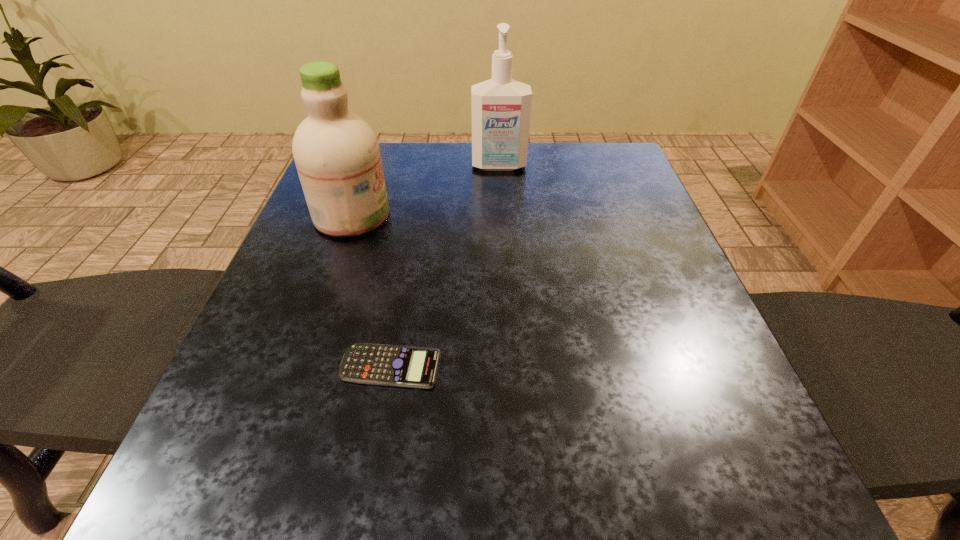
Locate an element on the screen. The image size is (960, 540). free location that satisfies the following two spatial constraints: 1. on the front label of the shortest object; 2. on the left side of the second nearest object is located at coordinates (299, 367).

You are a GUI agent. You are given a task and a screenshot of the screen. Output one action in this format:
    pyautogui.click(x=<x>, y=<y>)
    Task: Click on the free spot that satisfies the following two spatial constraints: 1. on the front label of the nearest object; 2. on the right side of the left cleansing agent
    The height and width of the screenshot is (540, 960).
    Given the screenshot: What is the action you would take?
    pyautogui.click(x=299, y=367)

Image resolution: width=960 pixels, height=540 pixels. I want to click on free space that satisfies the following two spatial constraints: 1. on the front label of the farther cleansing agent; 2. on the front label of the left cleansing agent, so click(502, 215).

You are a GUI agent. You are given a task and a screenshot of the screen. Output one action in this format:
    pyautogui.click(x=<x>, y=<y>)
    Task: Click on the vacant space that satisfies the following two spatial constraints: 1. on the front label of the calculator; 2. on the right side of the second nearest object
    This screenshot has width=960, height=540.
    Given the screenshot: What is the action you would take?
    pyautogui.click(x=299, y=367)

This screenshot has width=960, height=540. Find the location of `vacant area that satisfies the following two spatial constraints: 1. on the front label of the right cleansing agent; 2. on the front label of the nearer cleansing agent`. vacant area that satisfies the following two spatial constraints: 1. on the front label of the right cleansing agent; 2. on the front label of the nearer cleansing agent is located at coordinates (502, 215).

At what (x,y) coordinates should I click in order to perform the action: click on free space that satisfies the following two spatial constraints: 1. on the front label of the farthest object; 2. on the front label of the nearer cleansing agent. Please return your answer as a coordinate pair (x, y). The height and width of the screenshot is (540, 960). Looking at the image, I should click on (502, 215).

You are a GUI agent. You are given a task and a screenshot of the screen. Output one action in this format:
    pyautogui.click(x=<x>, y=<y>)
    Task: Click on the free region that satisfies the following two spatial constraints: 1. on the front label of the second nearest object; 2. on the right side of the shortest object
    
    Given the screenshot: What is the action you would take?
    pyautogui.click(x=299, y=367)

What are the coordinates of `free space that satisfies the following two spatial constraints: 1. on the front label of the nearest object; 2. on the right side of the left cleansing agent` in the screenshot? It's located at pyautogui.click(x=299, y=367).